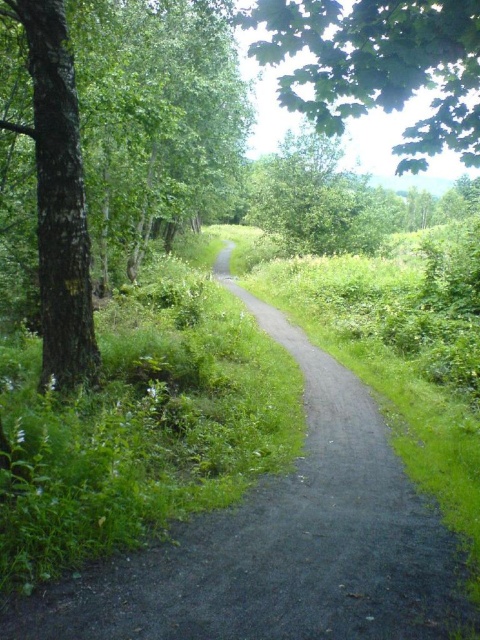
Question: Does dirt path at center appear under green leafy tree at upper center?

Choices:
 (A) no
 (B) yes

Answer: (B)

Question: Is green leafy tree at upper center thinner than smooth bark tree at left?

Choices:
 (A) yes
 (B) no

Answer: (B)

Question: Which is farther from the smooth bark tree at left?

Choices:
 (A) dirt path at center
 (B) green leafy tree at upper center

Answer: (B)

Question: Is green leafy tree at upper center to the left of smooth bark tree at left from the viewer's perspective?

Choices:
 (A) no
 (B) yes

Answer: (A)

Question: Which object is the farthest from the smooth bark tree at left?

Choices:
 (A) dirt path at center
 (B) green leafy tree at upper center

Answer: (B)

Question: Which object is the farthest from the green leafy tree at upper center?

Choices:
 (A) dirt path at center
 (B) smooth bark tree at left

Answer: (A)